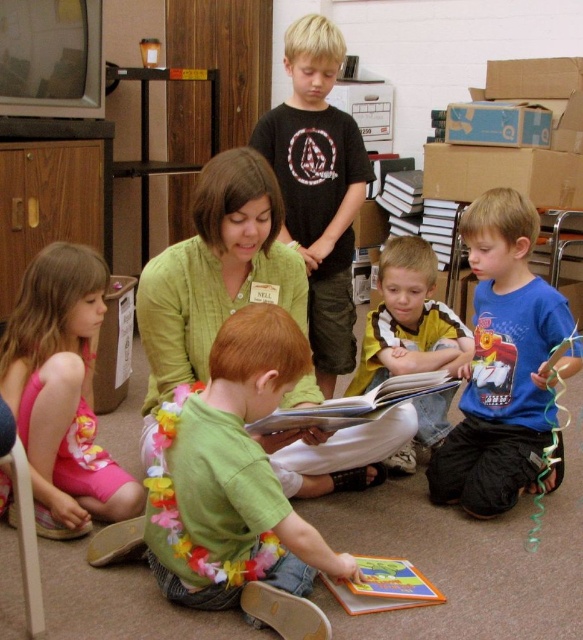
You are a delivery robot with a height of 1.4 meters. You need to deliver a package to the green fabric shirt at center. Can you reach the person without needing to adjust your height?

The distance between the green fabric shirt at center and the camera is 1.45 meters. Since the robot is 1.4 meters tall, it cannot reach the person as it is 0.05 meters shorter than the required distance.

You are a child sitting on the floor in the middle of the room. You want to hand your hardcover book at center to the adult wearing the green fabric shirt at center. Can you reach the adult without moving from your current position? The average arm length of a child is about 12 inches.

The distance between the green fabric shirt at center and the hardcover book at center is 11.39 inches. Since the average child arm length is about 12 inches, you can reach the adult by extending your arm.

You are standing at the center of the image. Which direction should you move to reach the pink fabric dress at lower left?

The pink fabric dress at lower left is located at the lower left position, so you should move towards the lower left direction to reach it.